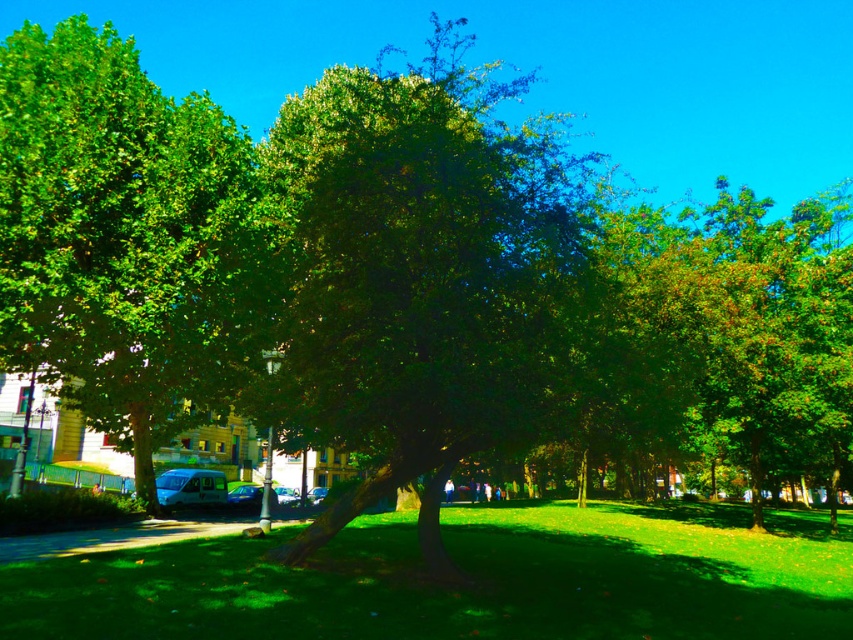
Does green leafy tree at center have a smaller size compared to metallic silver car at center?

No, green leafy tree at center is not smaller than metallic silver car at center.

Does green leafy tree at center appear on the left side of metallic silver car at center?

In fact, green leafy tree at center is to the right of metallic silver car at center.

In order to click on green leafy tree at center in this screenshot , I will do `click(125, 237)`.

Where is `green leafy tree at center`? green leafy tree at center is located at coordinates (125, 237).

Between green leafy tree at center and metallic silver van at lower left, which one has less height?

metallic silver van at lower left is shorter.

Is point (109, 252) behind point (183, 493)?

No, (109, 252) is in front of (183, 493).

You are a GUI agent. You are given a task and a screenshot of the screen. Output one action in this format:
    pyautogui.click(x=<x>, y=<y>)
    Task: Click on the green leafy tree at center
    The width and height of the screenshot is (853, 640).
    Given the screenshot: What is the action you would take?
    pyautogui.click(x=125, y=237)

Is the position of metallic silver van at lower left less distant than that of metallic silver car at center?

Yes, it is in front of metallic silver car at center.

Does metallic silver van at lower left have a lesser height compared to metallic silver car at center?

In fact, metallic silver van at lower left may be taller than metallic silver car at center.

The height and width of the screenshot is (640, 853). Describe the element at coordinates (190, 486) in the screenshot. I see `metallic silver van at lower left` at that location.

Find the location of a particular element. The height and width of the screenshot is (640, 853). metallic silver van at lower left is located at coordinates (190, 486).